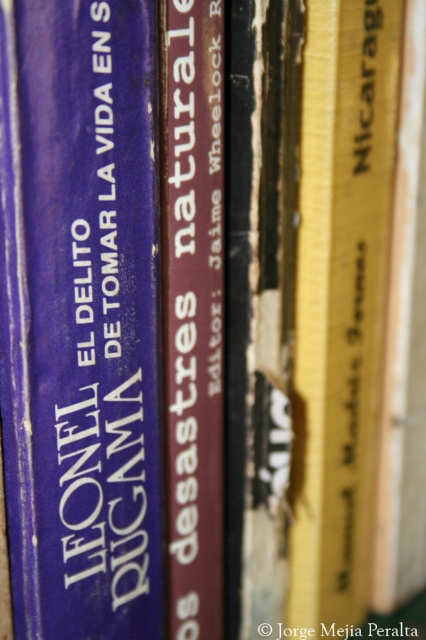
Question: Among these objects, which one is farthest from the camera?

Choices:
 (A) yellow matte book at center
 (B) maroon leather book at center

Answer: (A)

Question: Can you confirm if matte blue book at center is thinner than maroon leather book at center?

Choices:
 (A) yes
 (B) no

Answer: (B)

Question: Which of the following is the closest to the observer?

Choices:
 (A) (123, 570)
 (B) (180, 512)
 (C) (391, 157)

Answer: (A)

Question: Is matte blue book at center closer to camera compared to yellow matte book at center?

Choices:
 (A) yes
 (B) no

Answer: (A)

Question: Which point is farther from the camera taking this photo?

Choices:
 (A) (152, 368)
 (B) (336, 593)
 (C) (184, 486)

Answer: (B)

Question: Is matte blue book at center to the left of yellow matte book at center from the viewer's perspective?

Choices:
 (A) no
 (B) yes

Answer: (B)